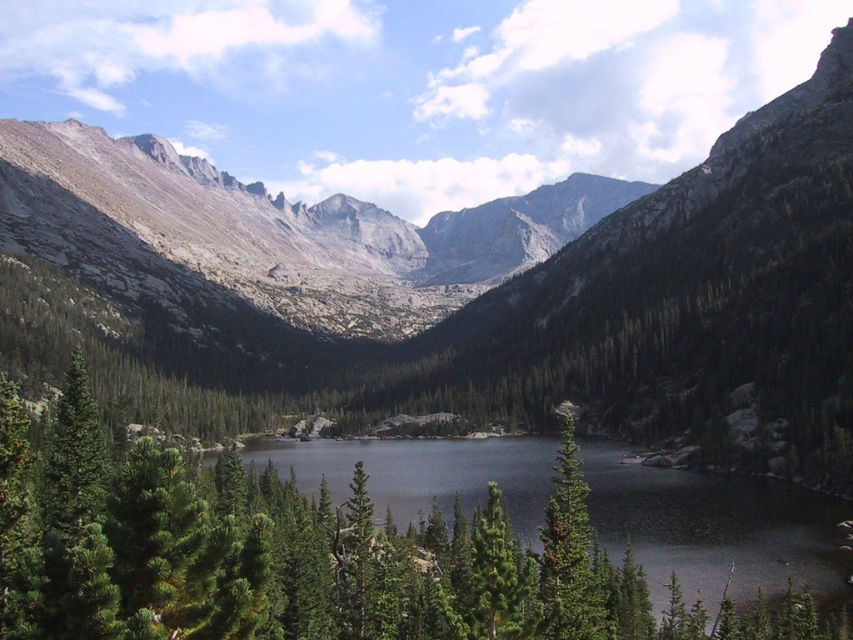
Question: Considering the relative positions of smooth dark water at center and green matte tree at center in the image provided, where is smooth dark water at center located with respect to green matte tree at center?

Choices:
 (A) above
 (B) below

Answer: (B)

Question: Estimate the real-world distances between objects in this image. Which object is closer to the smooth dark water at center?

Choices:
 (A) smooth gray rock at center
 (B) green matte tree at center

Answer: (B)

Question: Does smooth gray rock at center have a larger size compared to smooth dark water at center?

Choices:
 (A) yes
 (B) no

Answer: (A)

Question: Which is nearer to the smooth gray rock at center?

Choices:
 (A) green matte tree at center
 (B) smooth dark water at center

Answer: (B)

Question: Which object is positioned closest to the smooth dark water at center?

Choices:
 (A) green matte tree at center
 (B) smooth gray rock at center

Answer: (A)

Question: Can you confirm if smooth dark water at center is wider than green matte tree at center?

Choices:
 (A) no
 (B) yes

Answer: (B)